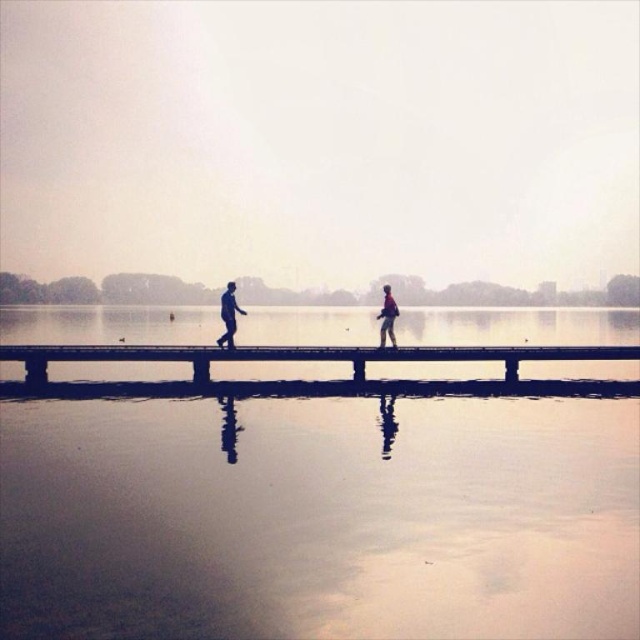
Question: In this image, where is smooth wooden dock at center located relative to matte black figure at center?

Choices:
 (A) below
 (B) above

Answer: (A)

Question: Considering the real-world distances, which object is closest to the matte black figure at center?

Choices:
 (A) smooth wooden dock at center
 (B) matte gray jacket at center

Answer: (A)

Question: Which point is closer to the camera taking this photo?

Choices:
 (A) 520,358
 (B) 385,312
 (C) 221,314

Answer: (A)

Question: Which of the following is the closest to the observer?

Choices:
 (A) (225, 342)
 (B) (387, 314)

Answer: (A)

Question: Can you confirm if matte black figure at center is wider than matte gray jacket at center?

Choices:
 (A) yes
 (B) no

Answer: (A)

Question: Can you confirm if matte black figure at center is positioned below matte gray jacket at center?

Choices:
 (A) no
 (B) yes

Answer: (A)